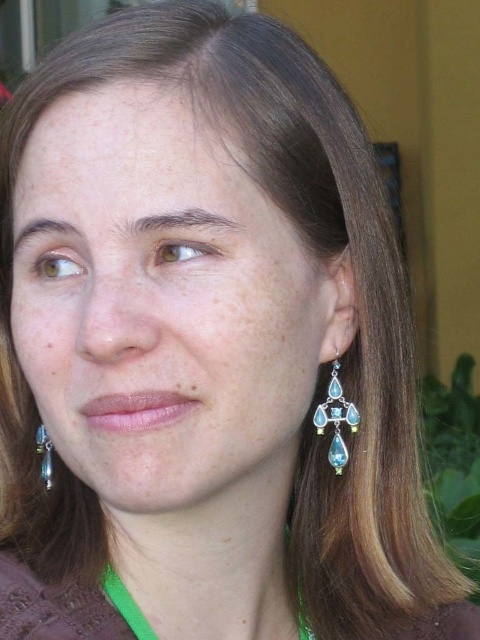
You are holding a 15 inch ruler and want to measure the distance to a specific point in the image. The point is located at coordinates point (339, 403). Can your ruler reach that point if you extend it fully?

The distance of point (339, 403) is 17.09 inches. Since the ruler is only 15 inches long, it cannot reach the point.

You are a photographer adjusting the camera focus. You notice two shiny silver earrings at right and a shiny silver earring at lower left. Which of these has a larger width when viewed from your current position?

The shiny silver earrings at right has a larger width than the shiny silver earring at lower left according to the description.